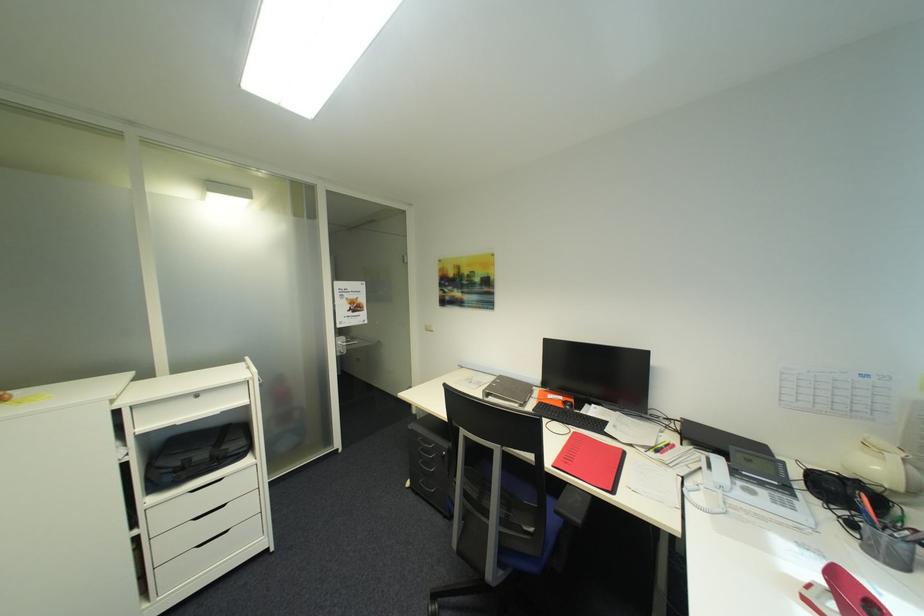
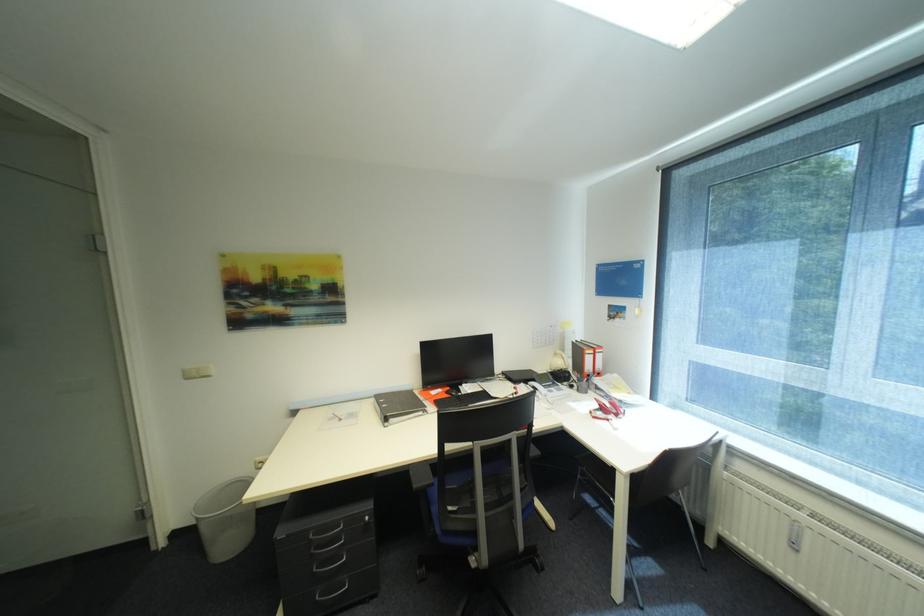
Question: How did the camera likely rotate?

Choices:
 (A) Left
 (B) Right
 (C) Up
 (D) Down

Answer: (B)